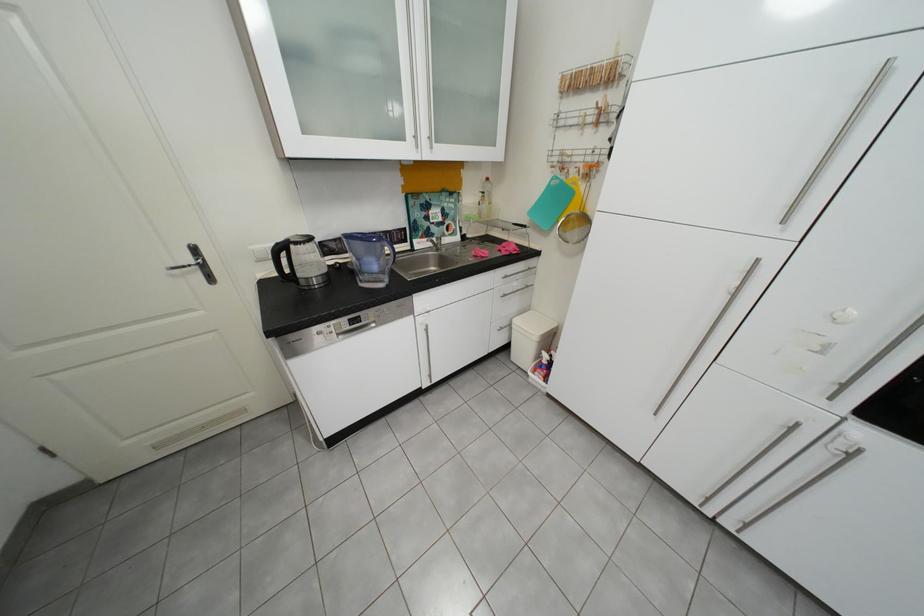
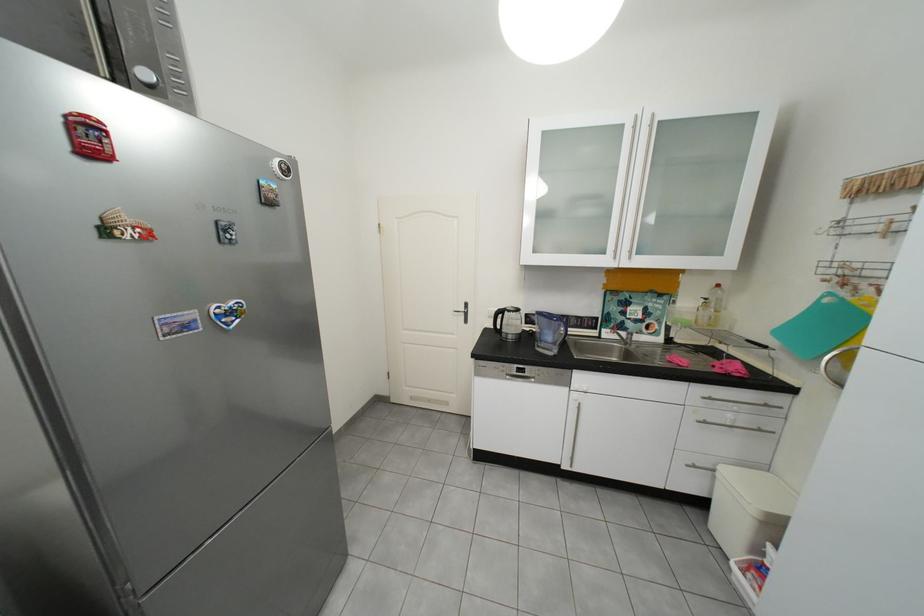
The point at (517,296) is marked in the first image. Where is the corresponding point in the second image?

(718, 424)